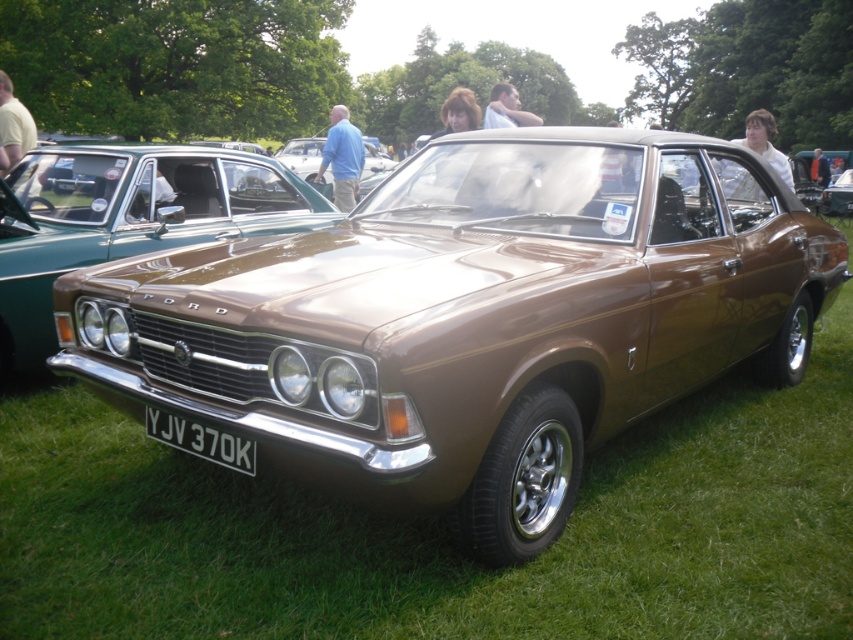
Question: Which of the following is the closest to the observer?

Choices:
 (A) brown metallic car at center
 (B) white plastic license plate at center

Answer: (B)

Question: Is shiny brown car at center bigger than white plastic license plate at center?

Choices:
 (A) yes
 (B) no

Answer: (A)

Question: Which object is farther from the camera taking this photo?

Choices:
 (A) shiny brown car at center
 (B) white plastic license plate at center
 (C) brown metallic car at center

Answer: (C)

Question: In this image, where is shiny brown car at center located relative to white plastic license plate at center?

Choices:
 (A) left
 (B) right

Answer: (B)

Question: Which point is closer to the camera?

Choices:
 (A) (198, 429)
 (B) (32, 250)

Answer: (A)

Question: Does shiny brown car at center appear on the right side of white plastic license plate at center?

Choices:
 (A) yes
 (B) no

Answer: (A)